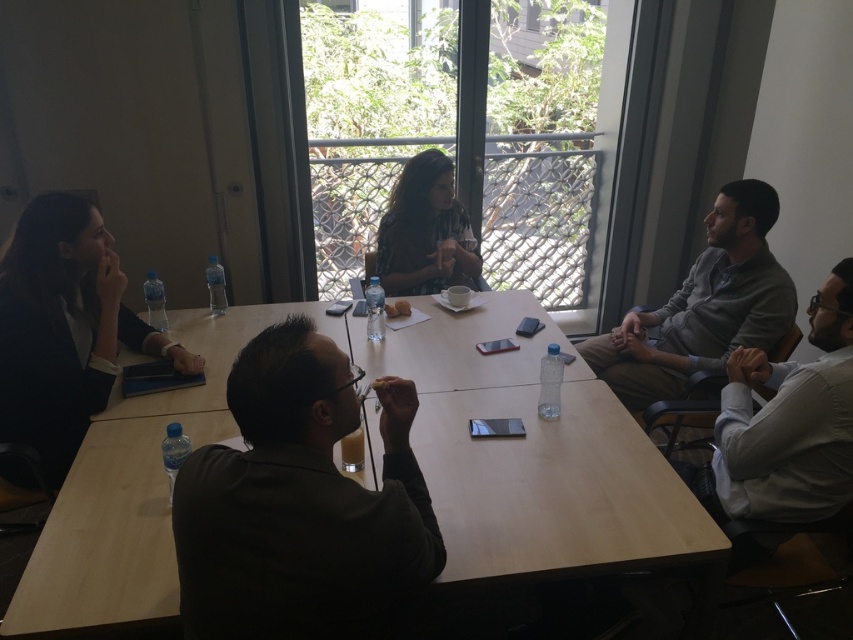
Is point (764, 497) in front of point (602, 380)?

Yes, it is in front of point (602, 380).

Does point (827, 321) lie behind point (724, 202)?

No, (827, 321) is closer to viewer.

This screenshot has width=853, height=640. Find the location of `white shirt at right`. white shirt at right is located at coordinates (785, 424).

Can you confirm if wooden table at center is positioned to the right of gray cotton shirt at right?

No, wooden table at center is not to the right of gray cotton shirt at right.

Measure the distance between wooden table at center and gray cotton shirt at right.

The distance of wooden table at center from gray cotton shirt at right is 28.59 inches.

Does point (607, 413) lie in front of point (738, 220)?

Yes.

This screenshot has height=640, width=853. I want to click on wooden table at center, so click(x=532, y=456).

Does gray cotton shirt at right have a greater height compared to matte black shirt at center?

Yes.

Is gray cotton shirt at right bigger than matte black shirt at center?

Correct, gray cotton shirt at right is larger in size than matte black shirt at center.

I want to click on gray cotton shirt at right, so click(703, 305).

At what (x,y) coordinates should I click in order to perform the action: click on gray cotton shirt at right. Please return your answer as a coordinate pair (x, y). The height and width of the screenshot is (640, 853). Looking at the image, I should click on (703, 305).